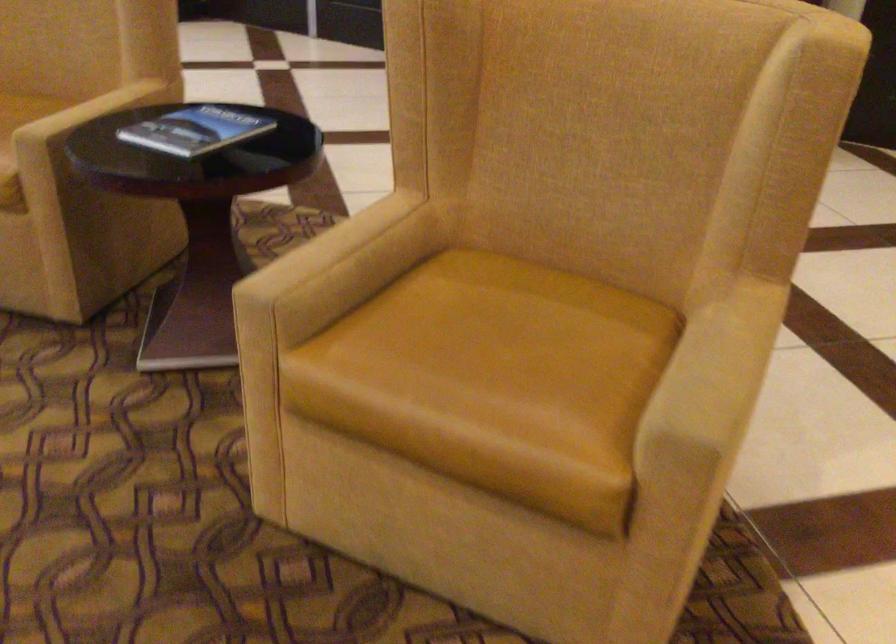
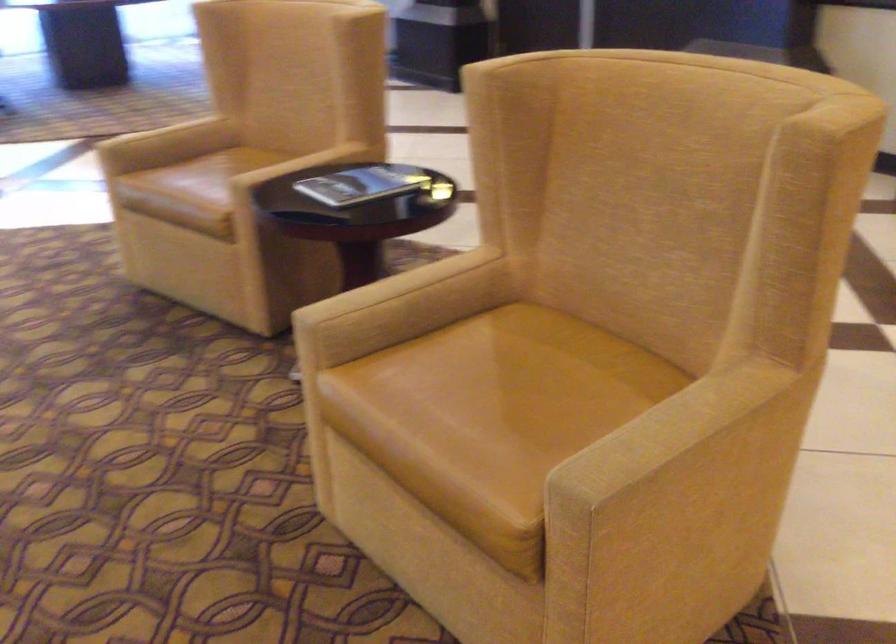
Find the pixel in the second image that matches point 199,126 in the first image.

(363, 184)